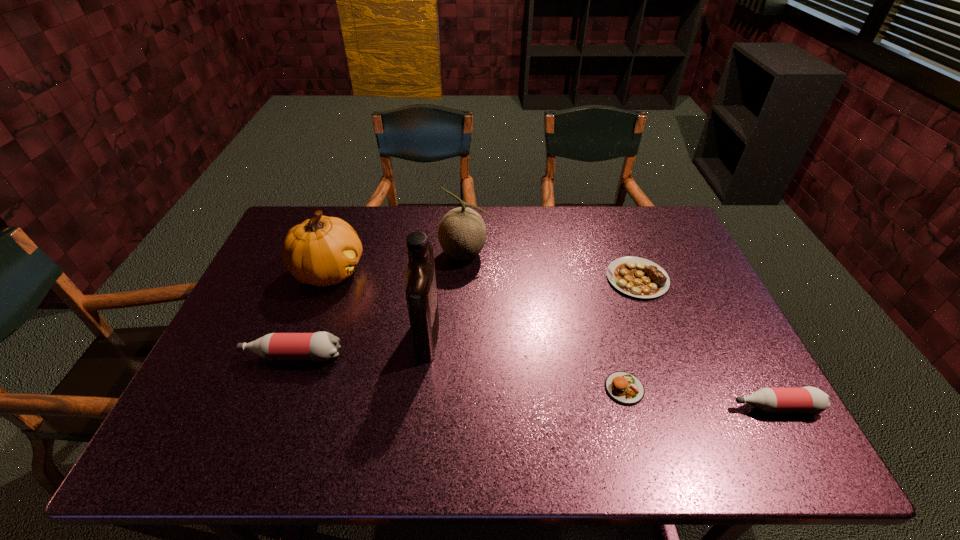
At what (x,y) coordinates should I click in order to perform the action: click on vacant space positioned with the cap open on the nearer bottle. Please return your answer as a coordinate pair (x, y). Looking at the image, I should click on (679, 407).

In order to click on free spot located with the cap open on the nearer bottle in this screenshot , I will do `click(701, 407)`.

This screenshot has width=960, height=540. I want to click on free space located 0.050m with the cap open on the nearer bottle, so click(709, 407).

Locate an element on the screen. The width and height of the screenshot is (960, 540). free space located 0.170m on the back of the cantaloup is located at coordinates (467, 210).

Locate an element on the screen. The image size is (960, 540). vacant area situated 0.270m on the back of the steak is located at coordinates (612, 210).

The height and width of the screenshot is (540, 960). Find the location of `vacant area located on the label side of the tallest object`. vacant area located on the label side of the tallest object is located at coordinates (511, 333).

Locate an element on the screen. The width and height of the screenshot is (960, 540). free space located 0.380m on the front face of the pumpkin is located at coordinates (491, 272).

Locate an element on the screen. The height and width of the screenshot is (540, 960). free space located 0.350m on the left of the patty is located at coordinates (457, 388).

Where is `cantaloup that is at the far edge`? cantaloup that is at the far edge is located at coordinates (462, 232).

Locate an element on the screen. This screenshot has width=960, height=540. pumpkin that is positioned at the far edge is located at coordinates (322, 251).